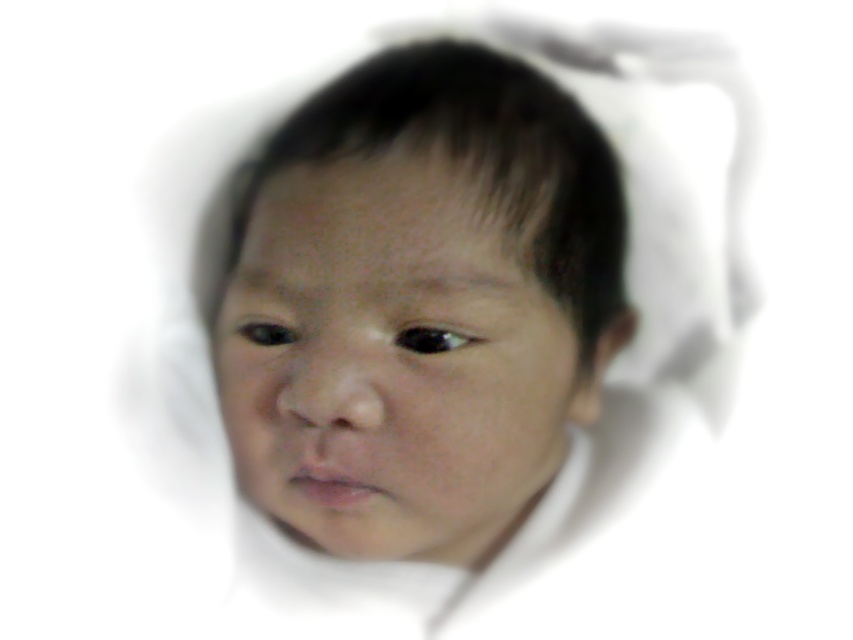
You are a photographer using a camera that requires the subject to be at least 60 centimeters away to avoid distortion. You are taking a photo of the smooth skin face at center. Based on the current distance, can you capture the photo without distortion?

The smooth skin face at center and camera are 55.33 centimeters apart, which is less than the required 60 centimeters. Therefore, capturing the photo at this distance may result in distortion.

Looking at this image, you are a photographer adjusting the focus of a camera. You have two points marked on the screen at point (514, 497) and point (277, 342). Which point is closer to the camera lens?

Point (277, 342) is closer to the camera lens because it is in front of point (514, 497).

The image shows a child with two eyes. The black glossy eye at center and the black eye at center are both visible. Which of these eyes has a greater width?

The black glossy eye at center has a greater width than the black eye at center.